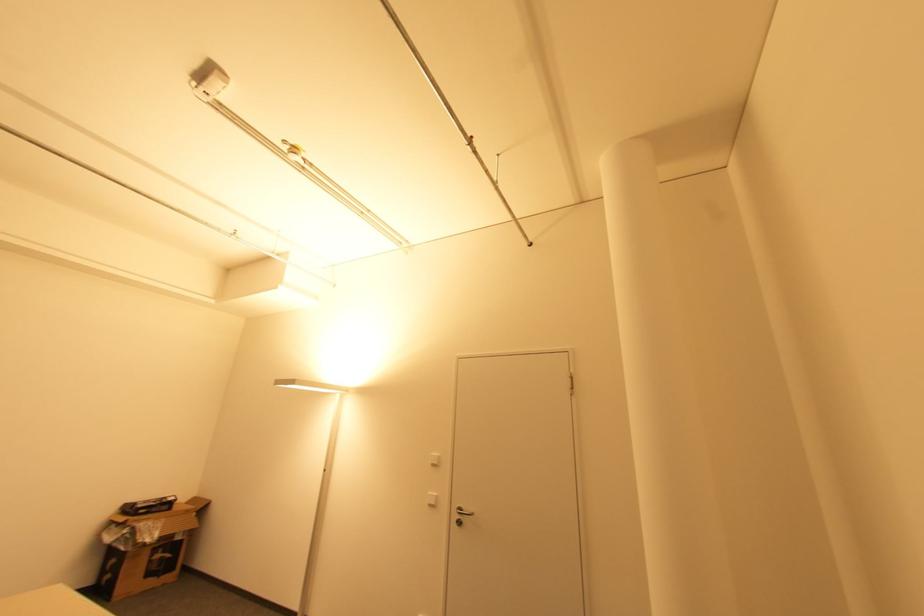
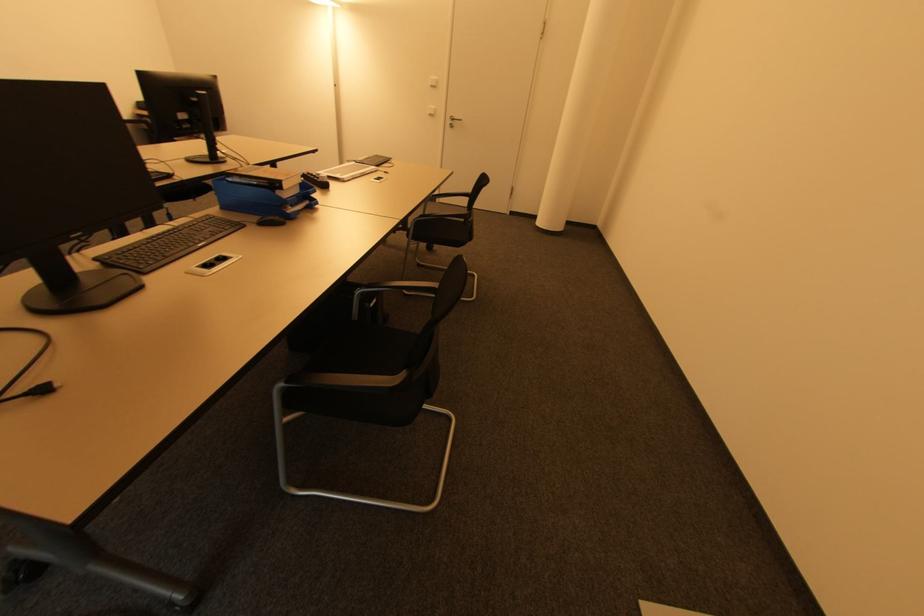
In the second image, find the point that corresponds to point (463, 524) in the first image.

(454, 127)